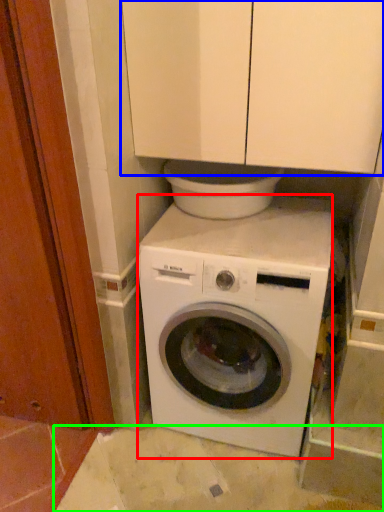
Question: Which object is the closest to the washing machine (highlighted by a red box)? Choose among these: cabinetry (highlighted by a blue box) or concrete (highlighted by a green box).

Choices:
 (A) cabinetry
 (B) concrete

Answer: (B)